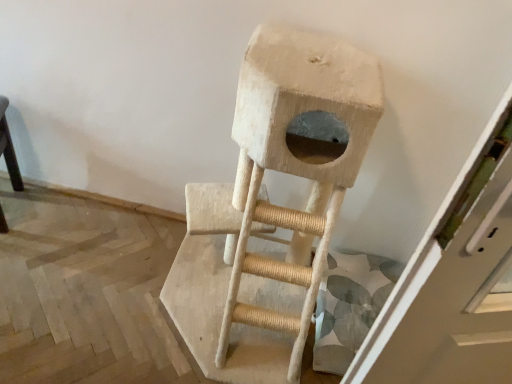
Question: In terms of size, does natural wood cat tree at center appear bigger or smaller than smooth black table at left?

Choices:
 (A) small
 (B) big

Answer: (B)

Question: Considering their positions, is natural wood cat tree at center located in front of or behind smooth black table at left?

Choices:
 (A) front
 (B) behind

Answer: (A)

Question: From a real-world perspective, is natural wood cat tree at center positioned above or below smooth black table at left?

Choices:
 (A) below
 (B) above

Answer: (B)

Question: In terms of height, does smooth black table at left look taller or shorter compared to natural wood cat tree at center?

Choices:
 (A) tall
 (B) short

Answer: (B)

Question: Is point (4, 97) positioned closer to the camera than point (230, 319)?

Choices:
 (A) farther
 (B) closer

Answer: (A)

Question: From a real-world perspective, is smooth black table at left positioned above or below natural wood cat tree at center?

Choices:
 (A) below
 (B) above

Answer: (A)

Question: Would you say smooth black table at left is inside or outside natural wood cat tree at center?

Choices:
 (A) inside
 (B) outside

Answer: (B)